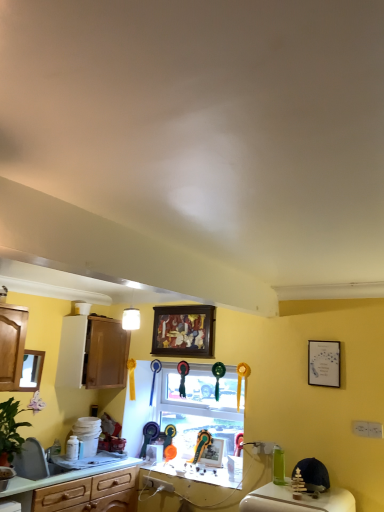
Question: Is metallic silver picture frame at center, the 1th picture frame when ordered from bottom to top, inside the boundaries of white glossy countertop at center, or outside?

Choices:
 (A) inside
 (B) outside

Answer: (B)

Question: Based on their sizes in the image, would you say metallic silver picture frame at center, the 4th picture frame when ordered from top to bottom, is bigger or smaller than white glossy countertop at center?

Choices:
 (A) big
 (B) small

Answer: (B)

Question: Based on their relative distances, which object is farther from the matte wood cabinet at left?

Choices:
 (A) metallic silver picture frame at center, the 4th picture frame in the front-to-back sequence
 (B) wooden mirror at left, which appears as the 3th picture frame when viewed from the top
 (C) white glossy sink at lower left
 (D) white matte picture frame at upper right, which is counted as the 2th picture frame, starting from the top
 (E) green laminate countertop at lower left

Answer: (D)

Question: Which is farther from the matte wood cabinet at left?

Choices:
 (A) wooden mirror at left, which appears as the 3th picture frame when viewed from the top
 (B) white matte picture frame at upper right, which is the first picture frame in right-to-left order
 (C) wooden framed artwork at upper center, which appears as the fourth picture frame when ordered from the bottom
 (D) white glossy sink at lower left
 (E) green laminate countertop at lower left

Answer: (B)